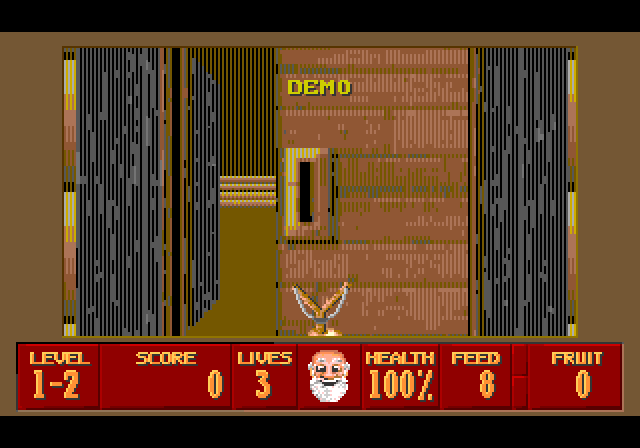
At what (x,y) coordinates should I click in order to perform the action: click on door. Please return your answer as a coordinate pair (x, y). The width and height of the screenshot is (640, 448). Looking at the image, I should click on (356, 195).